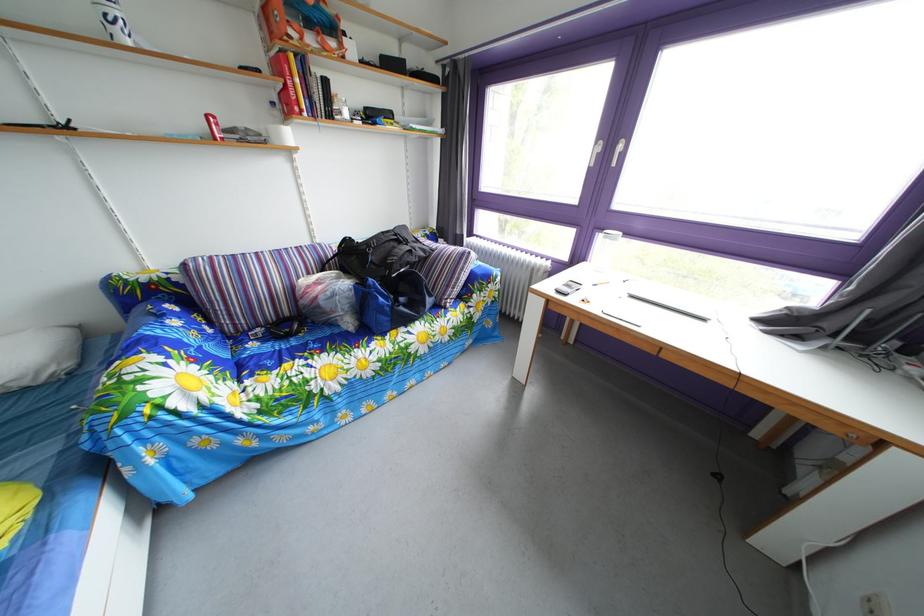
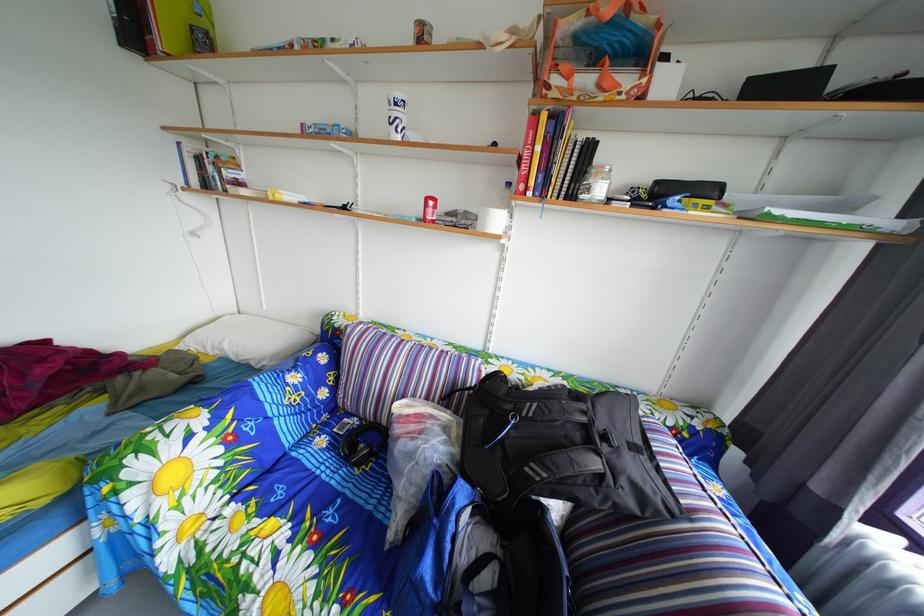
Find the pixel in the second image that matches point 424,251 in the first image.

(643, 456)